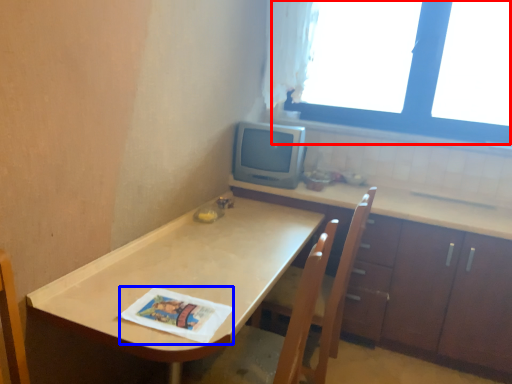
Question: Which object appears farthest to the camera in this image, window (highlighted by a red box) or magazine (highlighted by a blue box)?

Choices:
 (A) window
 (B) magazine

Answer: (A)